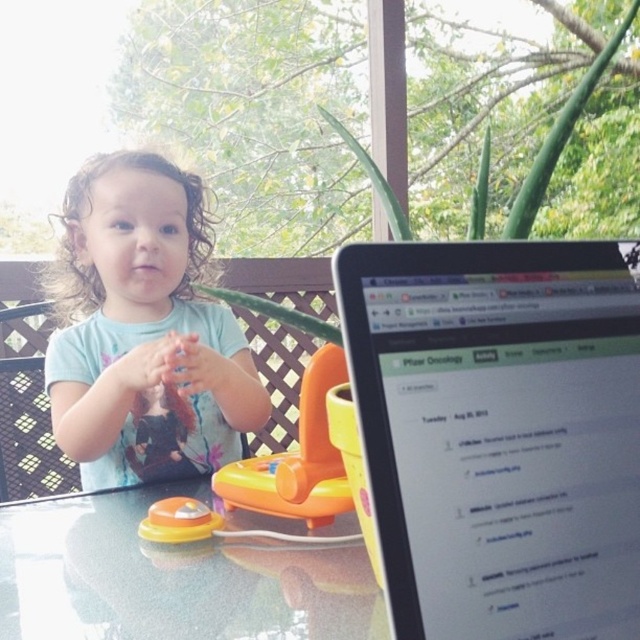
Measure the distance from matte black laptop at center to translucent orange toy at center.

15.61 inches

Is matte black laptop at center further to camera compared to translucent orange toy at center?

No, it is in front of translucent orange toy at center.

Find the location of a particular element. The height and width of the screenshot is (640, 640). matte black laptop at center is located at coordinates (499, 433).

Is light blue cotton toddler at center thinner than translucent orange toy at center?

No.

Between point (170, 269) and point (195, 509), which one is positioned in front?

Point (195, 509) is more forward.

Where is `light blue cotton toddler at center`? The image size is (640, 640). light blue cotton toddler at center is located at coordinates (144, 332).

What are the coordinates of `light blue cotton toddler at center` in the screenshot? It's located at (144, 332).

Does matte black laptop at center have a lesser width compared to light blue cotton toddler at center?

Yes.

Who is more distant from viewer, [554,580] or [56,380]?

Point [56,380]

The image size is (640, 640). Identify the location of matte black laptop at center. (499, 433).